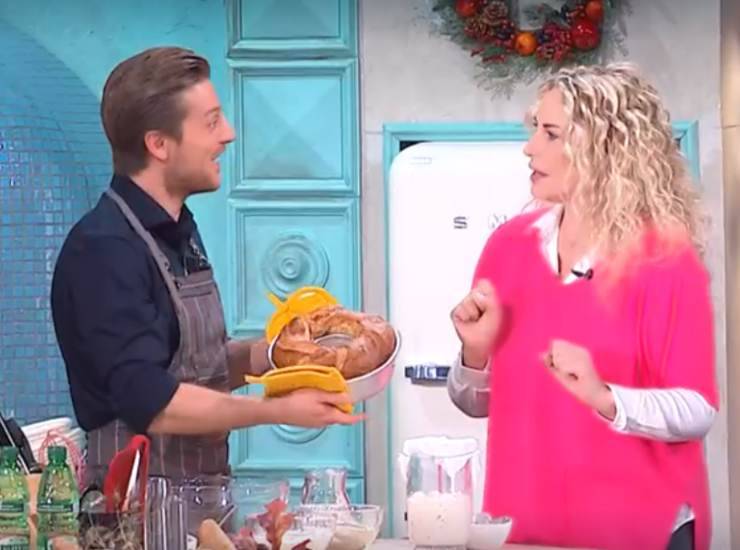
Identify the location of counter. The image size is (740, 550). (390, 548).